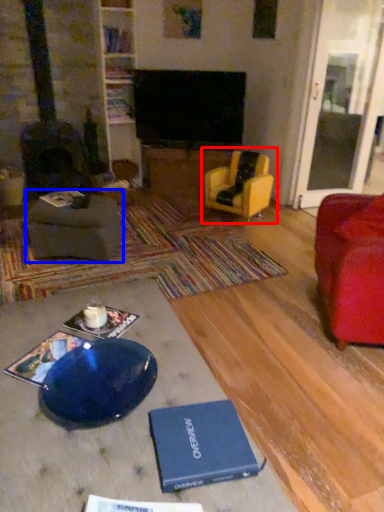
Question: Which object is closer to the camera taking this photo, chair (highlighted by a red box) or footrest (highlighted by a blue box)?

Choices:
 (A) chair
 (B) footrest

Answer: (B)